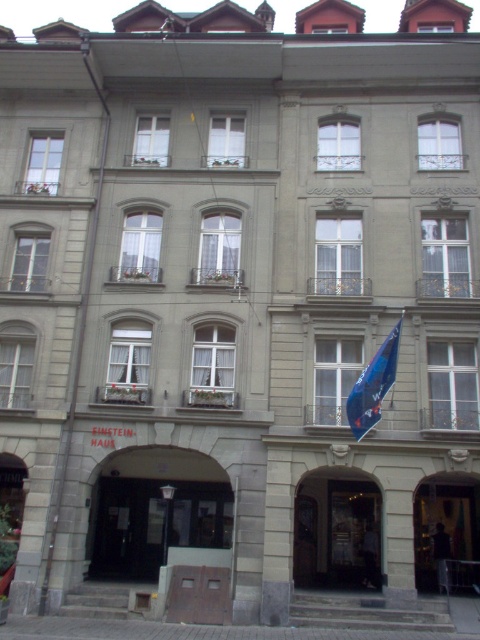
Question: Among these objects, which one is farthest from the camera?

Choices:
 (A) matte glass door at center
 (B) matte glass door at lower right

Answer: (A)

Question: Is matte glass door at center to the right of matte glass door at lower right from the viewer's perspective?

Choices:
 (A) no
 (B) yes

Answer: (A)

Question: Can you confirm if matte glass door at center is thinner than matte glass door at lower right?

Choices:
 (A) yes
 (B) no

Answer: (B)

Question: Which of the following is the farthest from the observer?

Choices:
 (A) (330, 579)
 (B) (416, 529)

Answer: (B)

Question: Where is matte glass door at center located in relation to blue fabric flag at center in the image?

Choices:
 (A) left
 (B) right

Answer: (A)

Question: Among these objects, which one is farthest from the camera?

Choices:
 (A) matte glass door at lower right
 (B) matte glass door at center
 (C) blue fabric flag at center

Answer: (B)